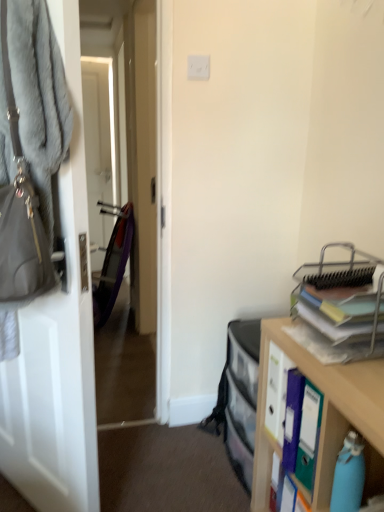
Question: Is gray furry handbag at left positioned before wooden cabinet at right?

Choices:
 (A) no
 (B) yes

Answer: (B)

Question: Considering the relative sizes of gray furry handbag at left and wooden cabinet at right in the image provided, is gray furry handbag at left thinner than wooden cabinet at right?

Choices:
 (A) no
 (B) yes

Answer: (B)

Question: From a real-world perspective, is gray furry handbag at left under wooden cabinet at right?

Choices:
 (A) yes
 (B) no

Answer: (B)

Question: Is gray furry handbag at left not within wooden cabinet at right?

Choices:
 (A) no
 (B) yes

Answer: (B)

Question: Is gray furry handbag at left positioned behind wooden cabinet at right?

Choices:
 (A) yes
 (B) no

Answer: (B)

Question: Considering the positions of metallic silver organizer at right and white matte door at left in the image, is metallic silver organizer at right bigger or smaller than white matte door at left?

Choices:
 (A) big
 (B) small

Answer: (B)

Question: From the image's perspective, is metallic silver organizer at right positioned above or below white matte door at left?

Choices:
 (A) above
 (B) below

Answer: (A)

Question: From a real-world perspective, is metallic silver organizer at right positioned above or below white matte door at left?

Choices:
 (A) above
 (B) below

Answer: (A)

Question: Is metallic silver organizer at right in front of or behind white matte door at left in the image?

Choices:
 (A) front
 (B) behind

Answer: (B)

Question: From a real-world perspective, is metallic silver organizer at right physically located above or below gray furry handbag at left?

Choices:
 (A) below
 (B) above

Answer: (A)

Question: Does point (316, 314) appear closer or farther from the camera than point (3, 29)?

Choices:
 (A) closer
 (B) farther

Answer: (B)

Question: From the image's perspective, is metallic silver organizer at right above or below gray furry handbag at left?

Choices:
 (A) below
 (B) above

Answer: (A)

Question: Relative to gray furry handbag at left, is metallic silver organizer at right in front or behind?

Choices:
 (A) front
 (B) behind

Answer: (B)

Question: From a real-world perspective, relative to gray furry handbag at left, is wooden cabinet at right vertically above or below?

Choices:
 (A) above
 (B) below

Answer: (B)

Question: Is point (329, 407) positioned closer to the camera than point (34, 234)?

Choices:
 (A) closer
 (B) farther

Answer: (B)